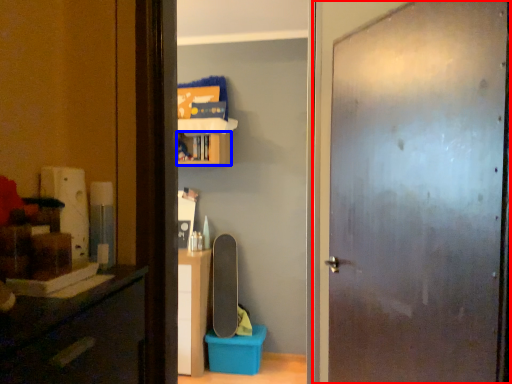
Question: Which point is closer to the camera, door (highlighted by a red box) or cabinet (highlighted by a blue box)?

Choices:
 (A) door
 (B) cabinet

Answer: (A)